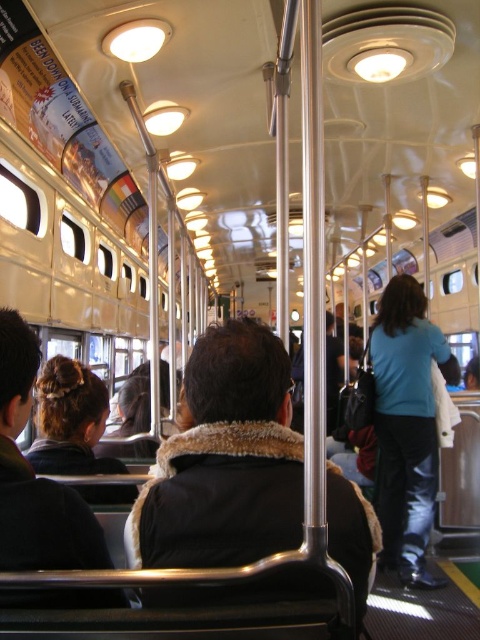
Question: Does dark brown fur-lined coat at center have a lesser width compared to blue fabric jacket at center?

Choices:
 (A) yes
 (B) no

Answer: (A)

Question: Can you confirm if dark brown fur-lined coat at center is thinner than blue fabric jacket at center?

Choices:
 (A) no
 (B) yes

Answer: (B)

Question: Is the position of dark brown fur-lined coat at center less distant than that of blue fabric jacket at center?

Choices:
 (A) yes
 (B) no

Answer: (A)

Question: Among these points, which one is farthest from the camera?

Choices:
 (A) (175, 588)
 (B) (412, 349)

Answer: (B)

Question: Which point is farther to the camera?

Choices:
 (A) (437, 451)
 (B) (223, 371)

Answer: (A)